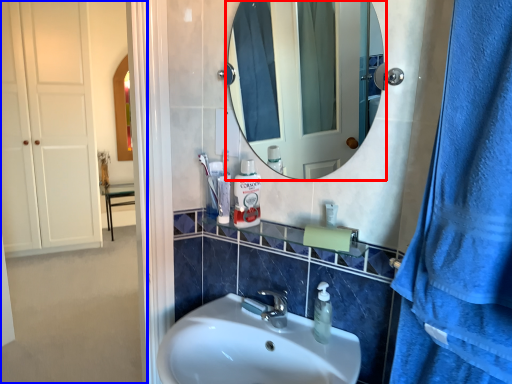
Question: Which point is further to the camera, mirror (highlighted by a red box) or side (highlighted by a blue box)?

Choices:
 (A) mirror
 (B) side

Answer: (B)